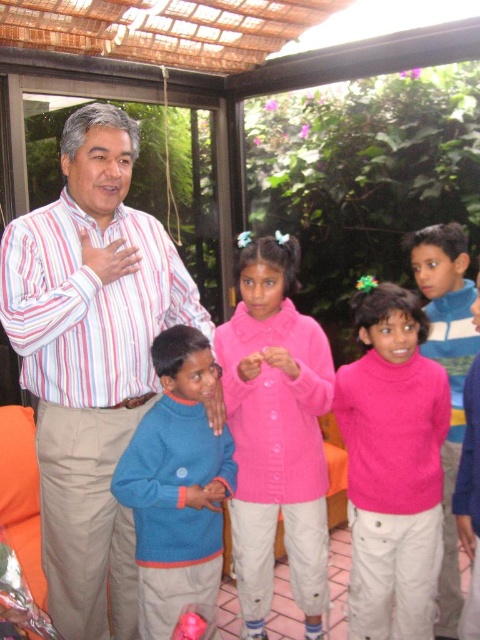
Question: Is pink matte sweater at center to the right of pink woolen sweater at center from the viewer's perspective?

Choices:
 (A) no
 (B) yes

Answer: (A)

Question: Observing the image, what is the correct spatial positioning of pink woolen sweater at center in reference to blue sweater at center?

Choices:
 (A) right
 (B) left

Answer: (A)

Question: Is pink woolen sweater at center bigger than blue sweater at center?

Choices:
 (A) yes
 (B) no

Answer: (B)

Question: Which object appears farthest from the camera in this image?

Choices:
 (A) blue sweater at center
 (B) striped cotton shirt at center
 (C) pink matte sweater at center
 (D) pink woolen sweater at center

Answer: (C)

Question: Which point is closer to the camera?

Choices:
 (A) (260, 547)
 (B) (20, 314)

Answer: (B)

Question: Which of the following is the closest to the observer?

Choices:
 (A) (260, 490)
 (B) (210, 467)
 (C) (92, 632)

Answer: (C)